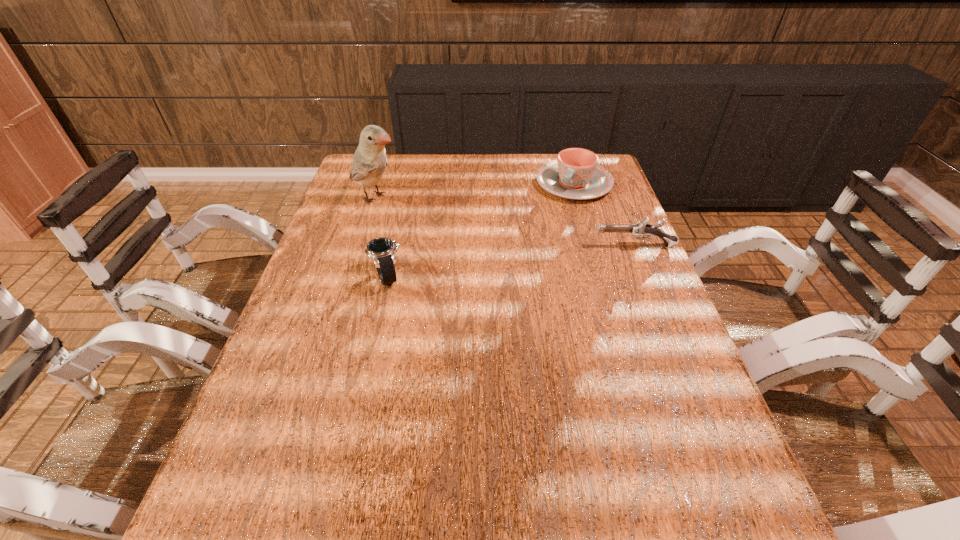
I want to click on free space located 0.240m on the handle side of the chinaware, so click(x=534, y=246).

At what (x,y) coordinates should I click in order to perform the action: click on free space located 0.140m at the face of the tallest object. Please return your answer as a coordinate pair (x, y). The height and width of the screenshot is (540, 960). Looking at the image, I should click on (x=431, y=220).

The width and height of the screenshot is (960, 540). Identify the location of vacant region located at the face of the tallest object. (454, 231).

I want to click on vacant space located 0.390m at the face of the tallest object, so click(x=500, y=251).

Identify the location of chinaware that is at the far edge. (576, 175).

What are the coordinates of `bird situated at the far edge` in the screenshot? It's located at pyautogui.click(x=369, y=162).

Find the location of a particular element. The height and width of the screenshot is (540, 960). object that is at the left edge is located at coordinates (369, 162).

Where is `gun that is at the right edge`? The height and width of the screenshot is (540, 960). gun that is at the right edge is located at coordinates (641, 228).

The height and width of the screenshot is (540, 960). Identify the location of chinaware that is at the right edge. (576, 175).

I want to click on object located in the far left corner section of the desktop, so click(369, 162).